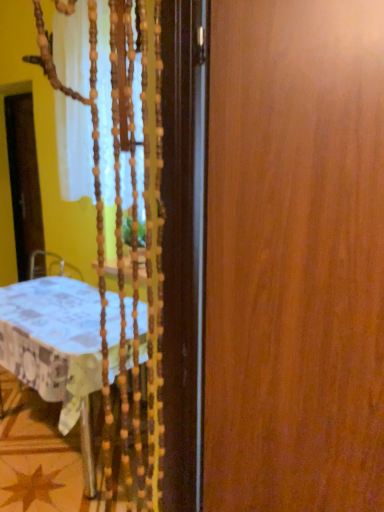
Question: Can you see wooden door at right touching white fabric tablecloth at left?

Choices:
 (A) no
 (B) yes

Answer: (A)

Question: Is wooden door at right not inside white fabric tablecloth at left?

Choices:
 (A) no
 (B) yes

Answer: (B)

Question: Does wooden door at right have a larger size compared to white fabric tablecloth at left?

Choices:
 (A) no
 (B) yes

Answer: (A)

Question: From the image's perspective, is wooden door at right under white fabric tablecloth at left?

Choices:
 (A) yes
 (B) no

Answer: (B)

Question: Does wooden door at right have a lesser width compared to white fabric tablecloth at left?

Choices:
 (A) yes
 (B) no

Answer: (A)

Question: Considering their positions, is white fabric tablecloth at left located in front of or behind transparent plastic screen door at left?

Choices:
 (A) front
 (B) behind

Answer: (A)

Question: From a real-world perspective, is white fabric tablecloth at left positioned above or below transparent plastic screen door at left?

Choices:
 (A) above
 (B) below

Answer: (B)

Question: Would you say white fabric tablecloth at left is to the left or to the right of transparent plastic screen door at left in the picture?

Choices:
 (A) left
 (B) right

Answer: (B)

Question: Is white fabric tablecloth at left taller or shorter than transparent plastic screen door at left?

Choices:
 (A) short
 (B) tall

Answer: (A)

Question: Is point (31, 233) positioned closer to the camera than point (77, 302)?

Choices:
 (A) farther
 (B) closer

Answer: (A)

Question: Relative to white fabric tablecloth at left, is transparent plastic screen door at left in front or behind?

Choices:
 (A) front
 (B) behind

Answer: (B)

Question: Looking at their shapes, would you say transparent plastic screen door at left is wider or thinner than white fabric tablecloth at left?

Choices:
 (A) thin
 (B) wide

Answer: (A)

Question: In terms of height, does transparent plastic screen door at left look taller or shorter compared to white fabric tablecloth at left?

Choices:
 (A) short
 (B) tall

Answer: (B)

Question: Is wooden door at right to the left or to the right of transparent plastic screen door at left in the image?

Choices:
 (A) right
 (B) left

Answer: (A)

Question: Does point (243, 99) appear closer or farther from the camera than point (38, 197)?

Choices:
 (A) farther
 (B) closer

Answer: (B)